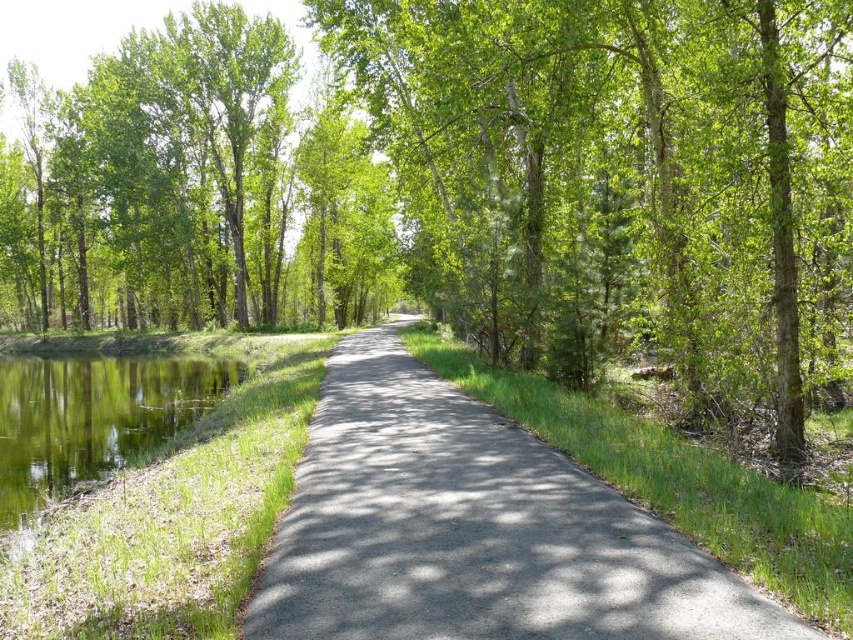
Which is in front, point (260, 579) or point (90, 445)?

Positioned in front is point (260, 579).

Is gray asphalt trail at center shorter than green grassy water at left?

Correct, gray asphalt trail at center is not as tall as green grassy water at left.

Identify the location of gray asphalt trail at center. (473, 529).

Between green leafy tree at center and green grassy water at left, which one has more height?

green leafy tree at center is taller.

From the picture: Can you confirm if green leafy tree at center is positioned to the right of green grassy water at left?

Correct, you'll find green leafy tree at center to the right of green grassy water at left.

Where is `green leafy tree at center`? green leafy tree at center is located at coordinates (625, 179).

Between point (824, 148) and point (538, 509), which one is positioned in front?

Point (538, 509) is in front.

Which is more to the right, green leafy tree at center or gray asphalt trail at center?

From the viewer's perspective, green leafy tree at center appears more on the right side.

Measure the distance between green leafy tree at center and camera.

green leafy tree at center and camera are 10.03 meters apart from each other.

What are the coordinates of `green leafy tree at center` in the screenshot? It's located at (625, 179).